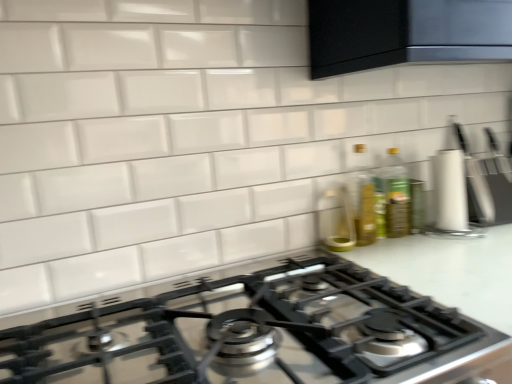
Image resolution: width=512 pixels, height=384 pixels. I want to click on vacant space in front of green glass bottle at upper right, which is counted as the 1th bottle, starting from the right, so click(x=422, y=251).